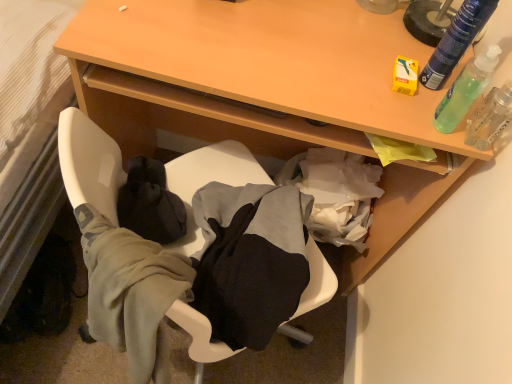
Locate an element on the screen. vacant space that is to the left of green translucent bottle at upper right, which appears as the 2th bottle when ordered from the bottom is located at coordinates (347, 56).